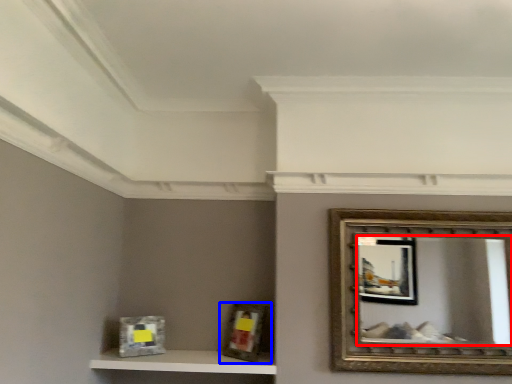
Question: Which object is further to the camera taking this photo, mirror (highlighted by a red box) or picture frame (highlighted by a blue box)?

Choices:
 (A) mirror
 (B) picture frame

Answer: (B)